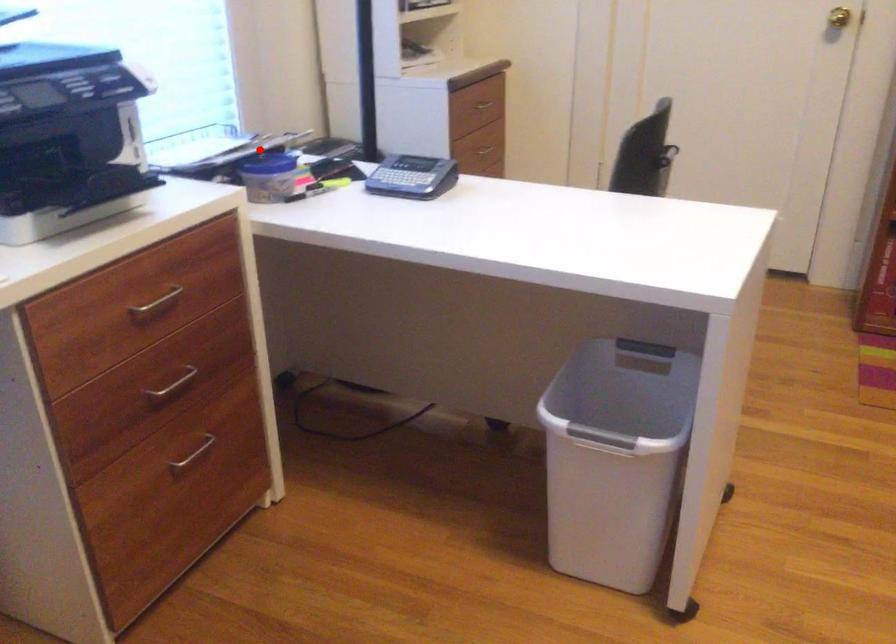
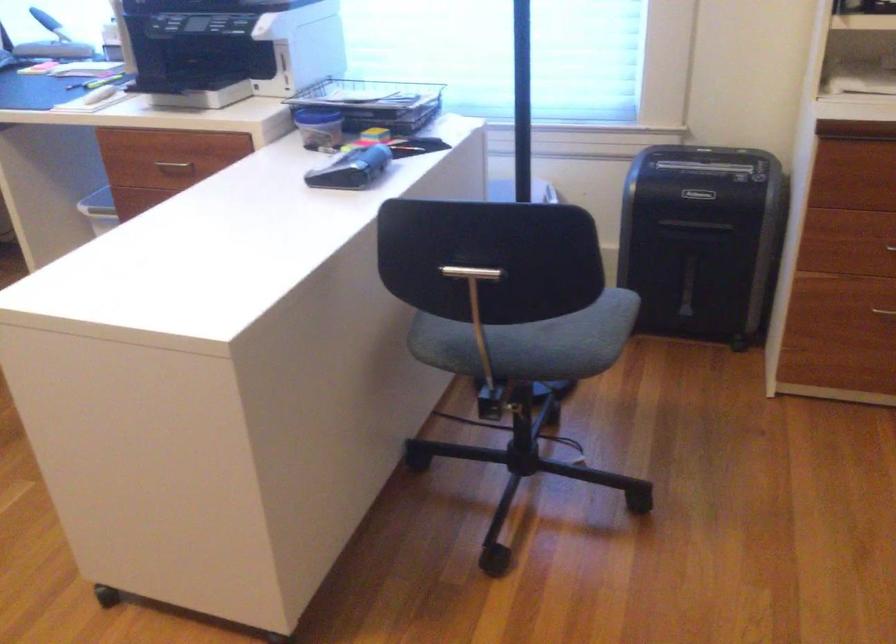
Question: I am providing you with two images of the same scene from different viewpoints. A red point is shown in image1. For the corresponding object point in image2, is it positioned nearer or farther from the camera?

Choices:
 (A) Nearer
 (B) Farther

Answer: (B)